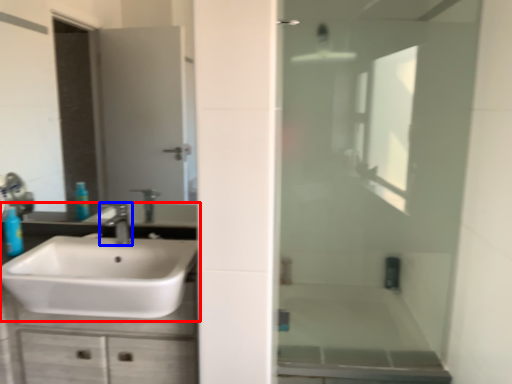
Question: Which of the following is the farthest to the observer, sink (highlighted by a red box) or tap (highlighted by a blue box)?

Choices:
 (A) sink
 (B) tap

Answer: (B)